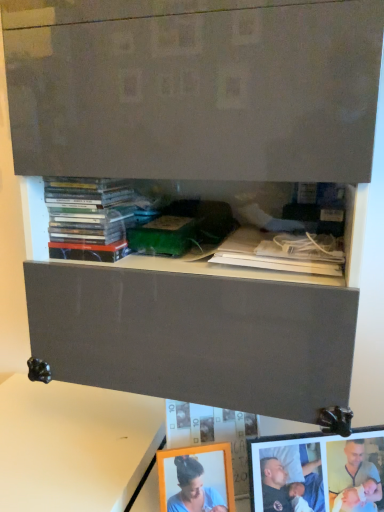
Question: Considering their positions, is matte wooden picture frame at lower right located in front of or behind white matte table at lower left?

Choices:
 (A) behind
 (B) front

Answer: (B)

Question: Would you say matte wooden picture frame at lower right is to the left or to the right of white matte table at lower left in the picture?

Choices:
 (A) right
 (B) left

Answer: (A)

Question: Which object is the closest to the white paper at upper center, the second book from the left?

Choices:
 (A) matte wooden picture frame at lower right
 (B) white matte table at lower left
 (C) matte plastic books at upper left, which is the second book in right-to-left order

Answer: (C)

Question: Considering the real-world distances, which object is closest to the matte plastic books at upper left, the first book viewed from the left?

Choices:
 (A) white matte table at lower left
 (B) white paper at upper center, acting as the 1th book starting from the right
 (C) matte wooden picture frame at lower right

Answer: (B)